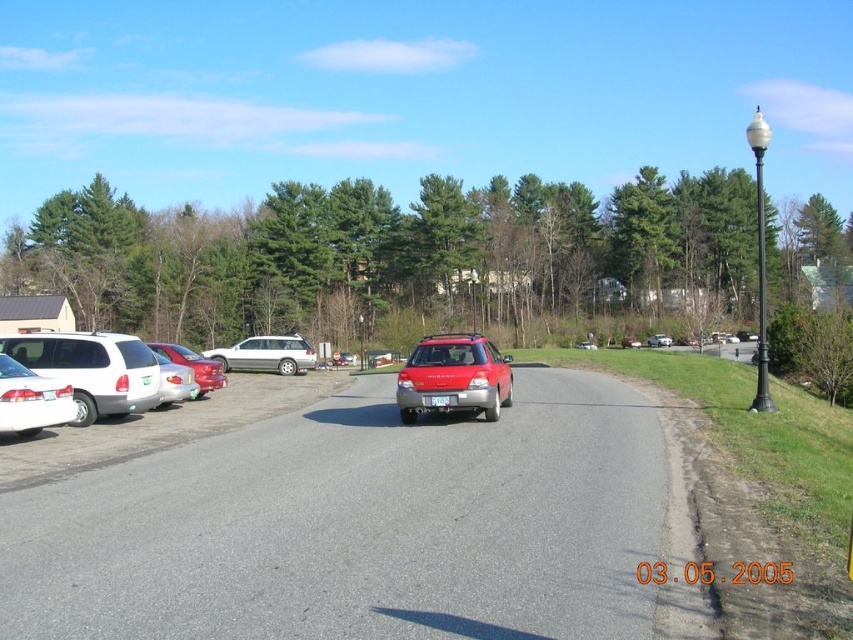
Question: Which object is the closest to the white matte minivan at left?

Choices:
 (A) metallic silver car at center
 (B) satin silver sedan at center
 (C) white plastic license plate at center
 (D) silver metallic station wagon at center-left

Answer: (A)

Question: Is matte red station wagon at center to the right of shiny red sedan at left from the viewer's perspective?

Choices:
 (A) yes
 (B) no

Answer: (A)

Question: Does white matte sedan at left appear on the right side of satin silver sedan at center?

Choices:
 (A) yes
 (B) no

Answer: (B)

Question: Is white matte sedan at left positioned behind silver metallic station wagon at center-left?

Choices:
 (A) no
 (B) yes

Answer: (A)

Question: Which object appears closest to the camera in this image?

Choices:
 (A) satin silver sedan at center
 (B) shiny red sedan at left
 (C) metallic silver car at center
 (D) silver metallic station wagon at center-left

Answer: (C)

Question: Which object is farther from the camera taking this photo?

Choices:
 (A) shiny red sedan at left
 (B) silver metallic station wagon at center-left

Answer: (B)